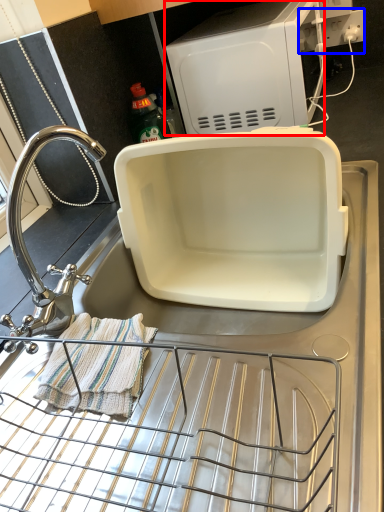
Question: Among these objects, which one is nearest to the camera, appliance (highlighted by a red box) or electric outlet (highlighted by a blue box)?

Choices:
 (A) appliance
 (B) electric outlet

Answer: (A)